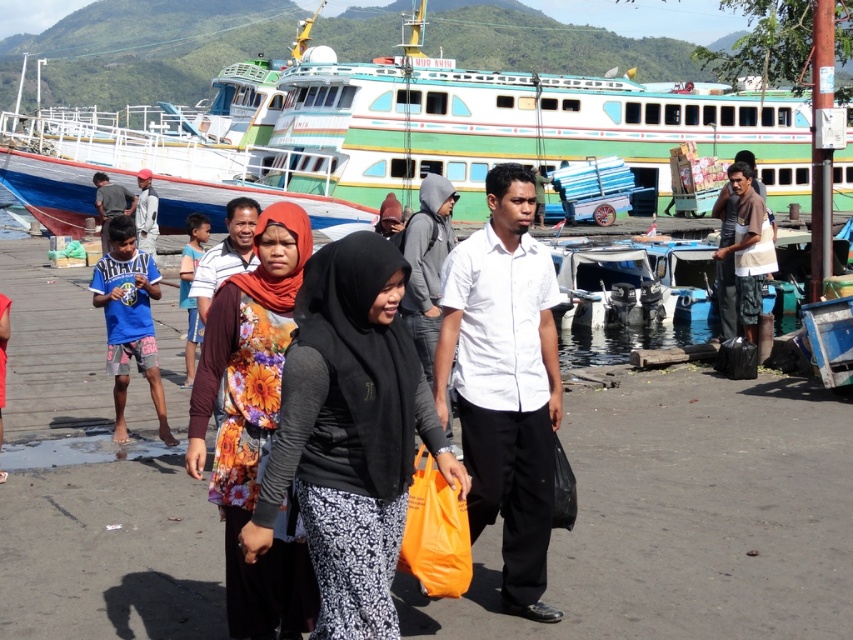
Can you confirm if white matte shirt at center is positioned below matte white shirt at center?

Yes, white matte shirt at center is below matte white shirt at center.

At what (x,y) coordinates should I click in order to perform the action: click on white matte shirt at center. Please return your answer as a coordinate pair (x, y). Image resolution: width=853 pixels, height=640 pixels. Looking at the image, I should click on (505, 381).

Where is `white matte shirt at center`? This screenshot has height=640, width=853. white matte shirt at center is located at coordinates (505, 381).

Which is more to the right, green painted wooden boat at upper center or black matte hijab at center?

Positioned to the right is black matte hijab at center.

Does green painted wooden boat at upper center have a lesser height compared to black matte hijab at center?

No, green painted wooden boat at upper center is not shorter than black matte hijab at center.

The image size is (853, 640). Find the location of `green painted wooden boat at upper center`. green painted wooden boat at upper center is located at coordinates (398, 134).

Locate an element on the screen. green painted wooden boat at upper center is located at coordinates (398, 134).

Is the position of green painted wooden boat at upper center more distant than that of matte white shirt at center?

Yes, green painted wooden boat at upper center is behind matte white shirt at center.

Who is more distant from viewer, (x=399, y=179) or (x=144, y=236)?

The point (x=399, y=179) is behind.

Between point (335, 140) and point (144, 220), which one is positioned behind?

Positioned behind is point (335, 140).

You are a GUI agent. You are given a task and a screenshot of the screen. Output one action in this format:
    pyautogui.click(x=<x>, y=<y>)
    Task: Click on the green painted wooden boat at upper center
    
    Given the screenshot: What is the action you would take?
    pyautogui.click(x=398, y=134)